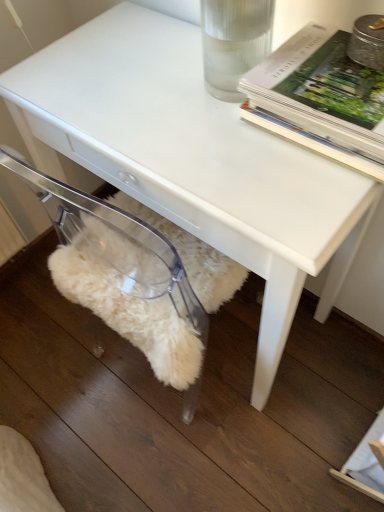
Question: Are transparent acrylic swivel chair at lower left and hardcover book at upper right beside each other?

Choices:
 (A) yes
 (B) no

Answer: (B)

Question: From the image's perspective, is transparent acrylic swivel chair at lower left on hardcover book at upper right?

Choices:
 (A) no
 (B) yes

Answer: (A)

Question: From a real-world perspective, is transparent acrylic swivel chair at lower left over hardcover book at upper right?

Choices:
 (A) yes
 (B) no

Answer: (B)

Question: Would you say transparent acrylic swivel chair at lower left contains hardcover book at upper right?

Choices:
 (A) no
 (B) yes

Answer: (A)

Question: Is transparent acrylic swivel chair at lower left positioned in front of hardcover book at upper right?

Choices:
 (A) no
 (B) yes

Answer: (A)

Question: Can you confirm if transparent acrylic swivel chair at lower left is positioned to the right of hardcover book at upper right?

Choices:
 (A) yes
 (B) no

Answer: (B)

Question: Is transparent acrylic swivel chair at lower left inside hardcover book at upper right?

Choices:
 (A) no
 (B) yes

Answer: (A)

Question: Is the surface of hardcover book at upper right in direct contact with transparent acrylic swivel chair at lower left?

Choices:
 (A) yes
 (B) no

Answer: (B)

Question: From the image's perspective, would you say hardcover book at upper right is positioned over transparent acrylic swivel chair at lower left?

Choices:
 (A) yes
 (B) no

Answer: (A)

Question: From the image's perspective, is hardcover book at upper right below transparent acrylic swivel chair at lower left?

Choices:
 (A) yes
 (B) no

Answer: (B)

Question: Is the position of hardcover book at upper right less distant than that of transparent acrylic swivel chair at lower left?

Choices:
 (A) no
 (B) yes

Answer: (B)

Question: From a real-world perspective, is hardcover book at upper right positioned over transparent acrylic swivel chair at lower left based on gravity?

Choices:
 (A) no
 (B) yes

Answer: (B)

Question: Is transparent acrylic swivel chair at lower left in front of or behind hardcover book at upper right in the image?

Choices:
 (A) behind
 (B) front

Answer: (A)